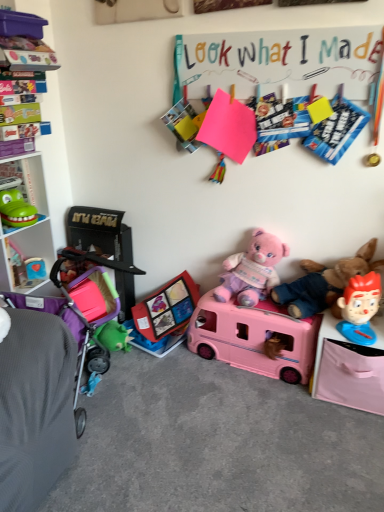
Question: Considering the positions of smooth red plastic toy at right, the third toy in the top-to-bottom sequence, and purple fabric baby carriage at left in the image, is smooth red plastic toy at right, the third toy in the top-to-bottom sequence, wider or thinner than purple fabric baby carriage at left?

Choices:
 (A) thin
 (B) wide

Answer: (A)

Question: From the image's perspective, is smooth red plastic toy at right, the third toy in the top-to-bottom sequence, located above or below purple fabric baby carriage at left?

Choices:
 (A) below
 (B) above

Answer: (B)

Question: Considering the real-world distances, which object is closest to the smooth red plastic toy at right, which appears as the 2th toy when ordered from the bottom?

Choices:
 (A) colored paperboard at upper center
 (B) soft pink plush at right, the 1th teddy bear when ordered from right to left
 (C) pink plastic toy bus at center, marked as the first toy in a bottom-to-top arrangement
 (D) pink plush teddy bear at center, acting as the second teddy bear starting from the right
 (E) white plastic cabinet at left

Answer: (B)

Question: Estimate the real-world distances between objects in this image. Which object is closer to the blue fabric toy at left, which ranks as the 3th toy in bottom-to-top order?

Choices:
 (A) pink plush teddy bear at center, positioned as the 1th teddy bear in left-to-right order
 (B) green rubbery toy at left, which is the fourth toy in bottom-to-top order
 (C) white plastic cabinet at left
 (D) soft pink plush at right, the 1th teddy bear when ordered from right to left
 (E) purple fabric baby carriage at left

Answer: (C)